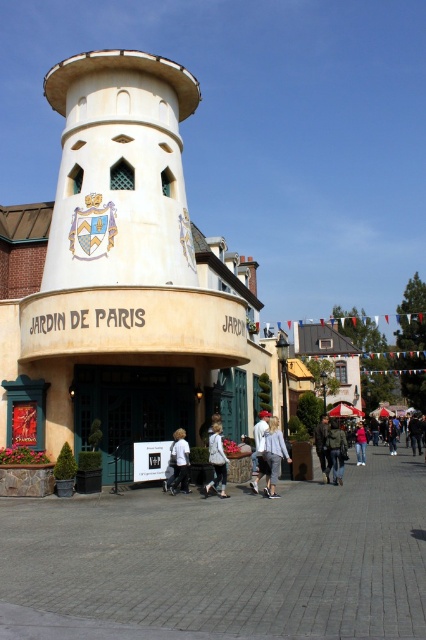
Which of these two, white shirt at center or pink fabric jacket at center, stands shorter?

With less height is white shirt at center.

Which is in front, point (264, 470) or point (362, 422)?

Point (264, 470)

Who is more forward, (x=259, y=461) or (x=356, y=438)?

Point (x=259, y=461) is more forward.

Identify the location of white shirt at center. This screenshot has height=640, width=426. (259, 451).

Does white shirt at center have a larger size compared to white matte shirt at center?

Yes.

How far apart are white shirt at center and white matte shirt at center?

white shirt at center and white matte shirt at center are 5.85 meters apart from each other.

The image size is (426, 640). What are the coordinates of `white shirt at center` in the screenshot? It's located at (259, 451).

Measure the distance between khaki fabric jacket at center and dark brown leather jacket at center.

khaki fabric jacket at center is 21.46 feet from dark brown leather jacket at center.

Does point (339, 461) come farther from viewer compared to point (327, 464)?

No, it is not.

You are a GUI agent. You are given a task and a screenshot of the screen. Output one action in this format:
    pyautogui.click(x=<x>, y=<y>)
    Task: Click on the khaki fabric jacket at center
    The width and height of the screenshot is (426, 640).
    Given the screenshot: What is the action you would take?
    pyautogui.click(x=336, y=451)